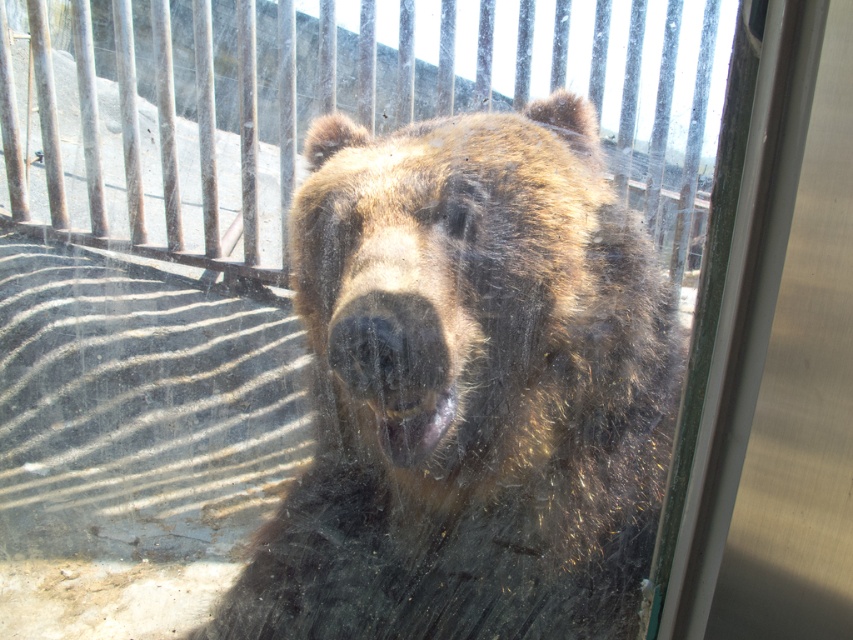
You are a zookeeper who needs to clean the enclosure of the fuzzy brown bear at center. The cleaning equipment is placed at point 0.609, 0.550. Is the equipment positioned correctly to reach the bear?

The fuzzy brown bear at center is located exactly at point (x=468, y=388), so the equipment is positioned correctly to reach the bear.

You are a zookeeper observing the enclosure through the glass. You notice the fuzzy brown bear at center and the wooden at center. Which object is positioned to the left?

The wooden at center is positioned to the left of the fuzzy brown bear at center.